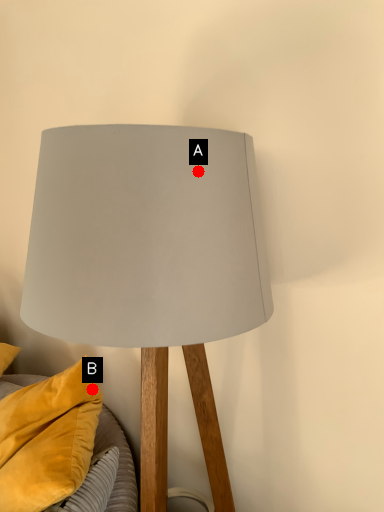
Question: Two points are circled on the image, labeled by A and B beside each circle. Which point is further to the camera?

Choices:
 (A) A is further
 (B) B is further

Answer: (B)